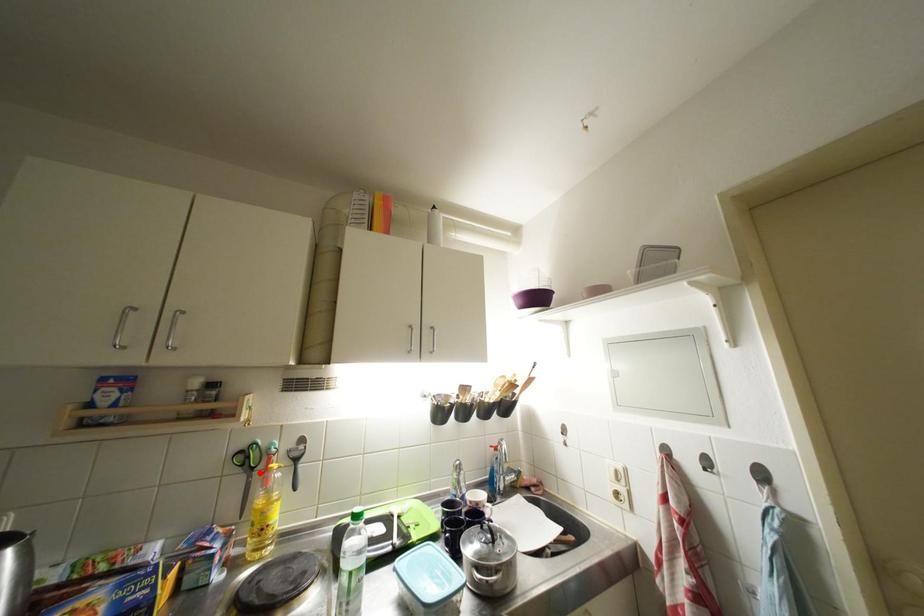
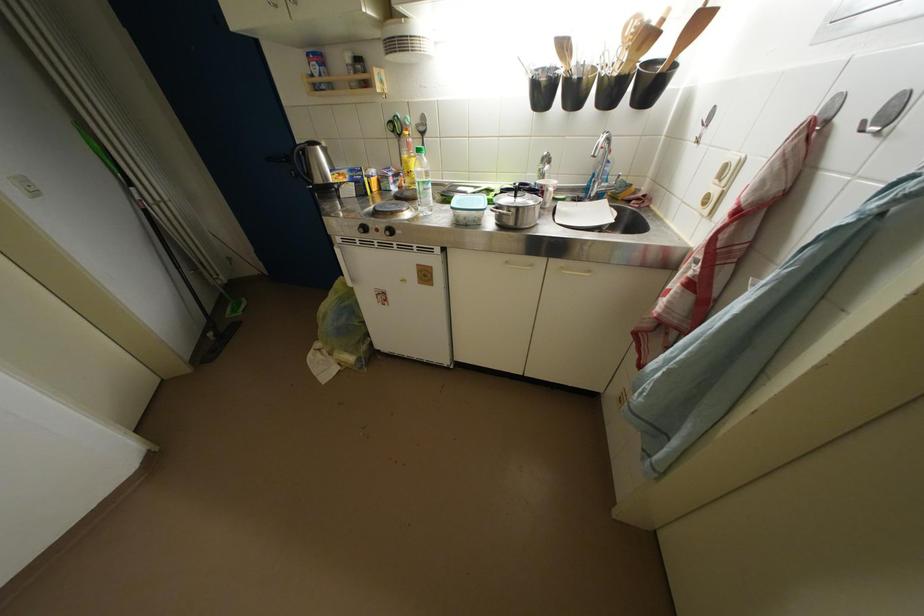
The point at the highlighted location is marked in the first image. Where is the corresponding point in the second image?

(407, 140)